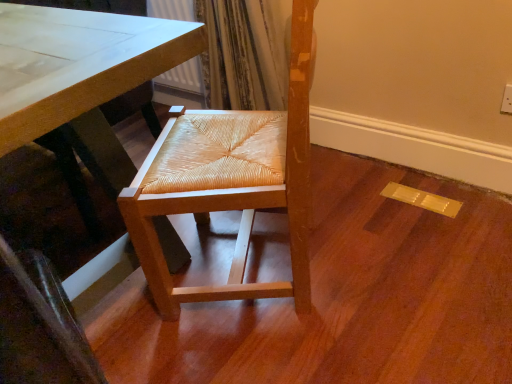
Question: Is matte white table at center looking in the opposite direction of natural wood woven seat at center?

Choices:
 (A) yes
 (B) no

Answer: (A)

Question: Considering the relative positions of matte white table at center and natural wood woven seat at center in the image provided, is matte white table at center in front of natural wood woven seat at center?

Choices:
 (A) no
 (B) yes

Answer: (B)

Question: From the image's perspective, is matte white table at center under natural wood woven seat at center?

Choices:
 (A) yes
 (B) no

Answer: (B)

Question: Is matte white table at center to the left of natural wood woven seat at center from the viewer's perspective?

Choices:
 (A) yes
 (B) no

Answer: (A)

Question: Is matte white table at center placed right next to natural wood woven seat at center?

Choices:
 (A) yes
 (B) no

Answer: (B)

Question: Is natural wood woven seat at center completely or partially inside matte white table at center?

Choices:
 (A) yes
 (B) no

Answer: (B)

Question: From a real-world perspective, is natural wood chair at center beneath natural wood woven seat at center?

Choices:
 (A) no
 (B) yes

Answer: (B)

Question: Can you confirm if natural wood chair at center is thinner than natural wood woven seat at center?

Choices:
 (A) no
 (B) yes

Answer: (A)

Question: From the image's perspective, is natural wood chair at center below natural wood woven seat at center?

Choices:
 (A) no
 (B) yes

Answer: (B)

Question: Would you say natural wood woven seat at center is part of natural wood chair at center's contents?

Choices:
 (A) no
 (B) yes

Answer: (A)

Question: Is natural wood chair at center oriented away from natural wood woven seat at center?

Choices:
 (A) yes
 (B) no

Answer: (B)

Question: Does natural wood chair at center have a larger size compared to natural wood woven seat at center?

Choices:
 (A) yes
 (B) no

Answer: (B)

Question: Can you confirm if natural wood woven seat at center is wider than natural wood chair at center?

Choices:
 (A) no
 (B) yes

Answer: (A)